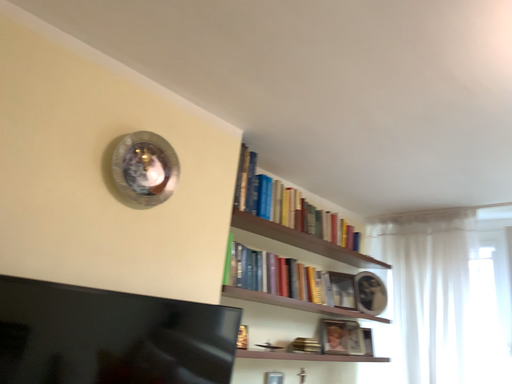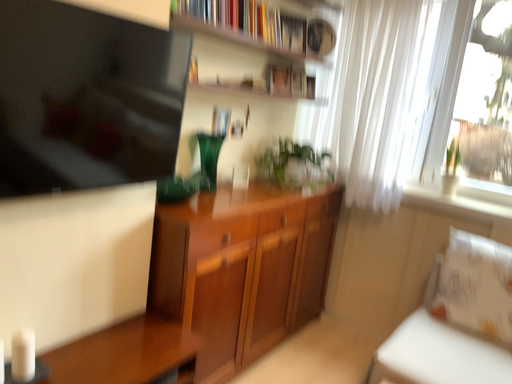
Question: How did the camera likely rotate when shooting the video?

Choices:
 (A) rotated right
 (B) rotated left

Answer: (A)